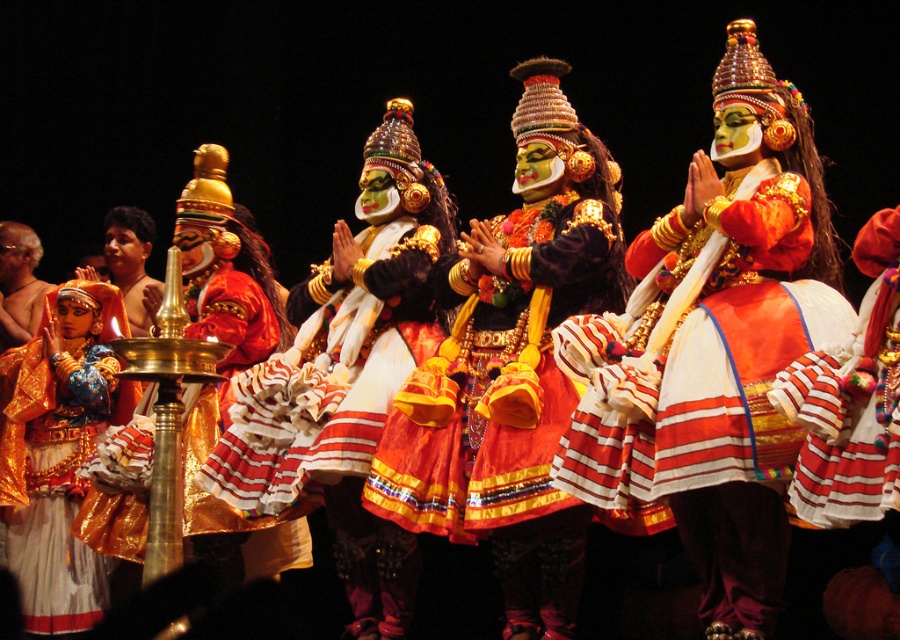
Question: Can you confirm if shiny gold headdress at center is positioned below matte gold ornament at left?

Choices:
 (A) no
 (B) yes

Answer: (A)

Question: Which object appears closest to the camera in this image?

Choices:
 (A) matte orange fabric at center
 (B) matte gold ornament at left
 (C) shiny gold headdress at center

Answer: (A)

Question: Where is shiny gold headdress at center located in relation to matte gold ornament at left in the image?

Choices:
 (A) right
 (B) left

Answer: (A)

Question: Which of the following is the closest to the observer?

Choices:
 (A) matte orange fabric at center
 (B) matte gold ornament at left
 (C) shiny gold headdress at center

Answer: (A)

Question: Estimate the real-world distances between objects in this image. Which object is farther from the matte orange fabric at center?

Choices:
 (A) matte gold ornament at left
 (B) shiny gold headdress at center

Answer: (A)

Question: Does matte orange fabric at center lie in front of shiny gold headdress at center?

Choices:
 (A) yes
 (B) no

Answer: (A)